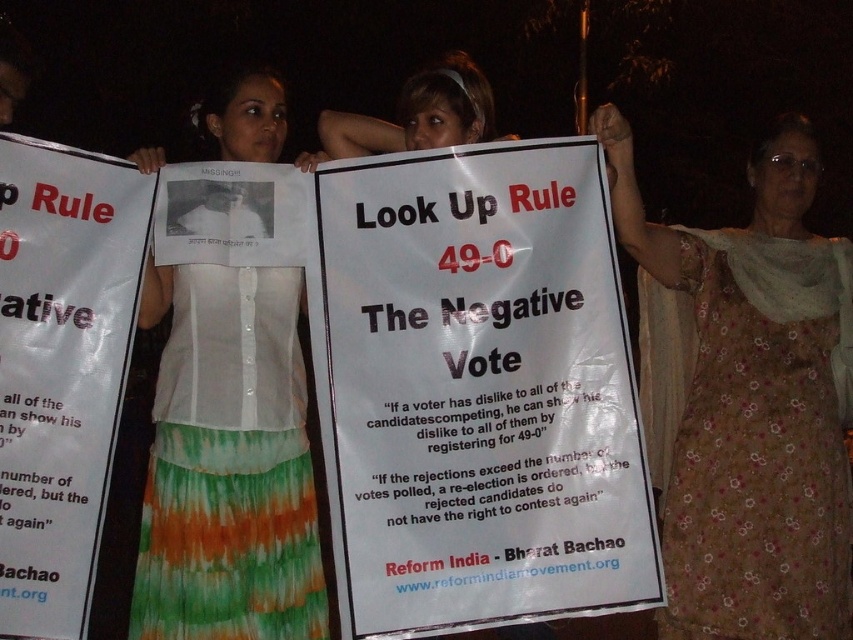
What are the coordinates of the floral printed dress at center?

The floral printed dress at center is located at coordinates point (746, 403).